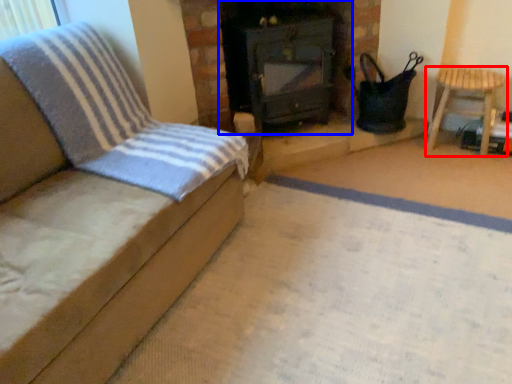
Question: Among these objects, which one is nearest to the camera, furniture (highlighted by a red box) or stove (highlighted by a blue box)?

Choices:
 (A) furniture
 (B) stove

Answer: (B)